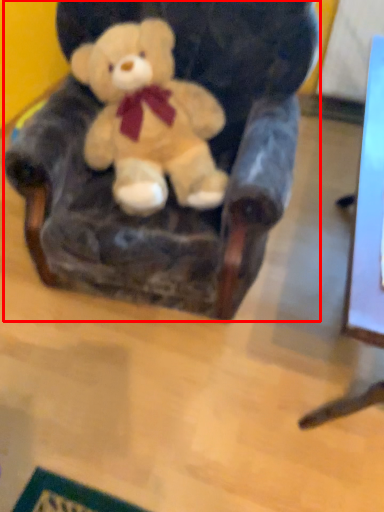
Question: From the image's perspective, what is the correct spatial relationship of armchair (annotated by the red box) in relation to teddy bear?

Choices:
 (A) below
 (B) above

Answer: (A)